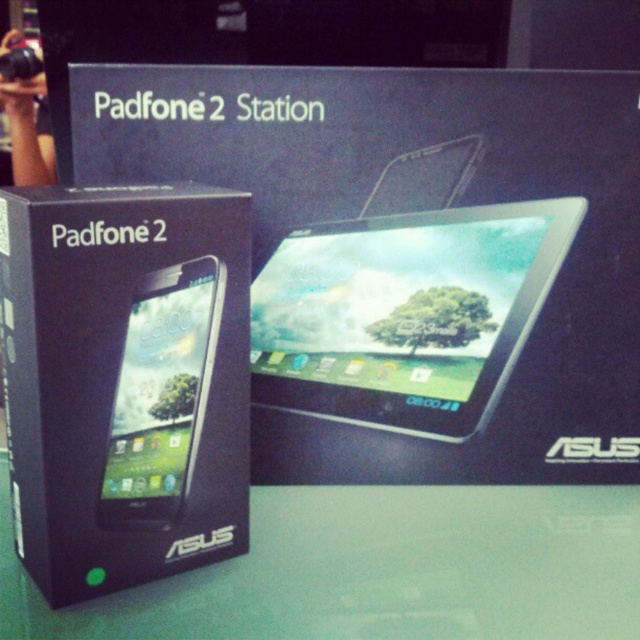
Question: Can you confirm if black matte box at center is positioned to the left of matte black tablet at center?

Choices:
 (A) no
 (B) yes

Answer: (B)

Question: Which of the following is the farthest from the observer?

Choices:
 (A) (129, 396)
 (B) (552, 230)

Answer: (B)

Question: Can you confirm if black matte box at center is bigger than matte black smartphone at center?

Choices:
 (A) yes
 (B) no

Answer: (A)

Question: Which of the following is the farthest from the observer?

Choices:
 (A) matte black smartphone at center
 (B) matte black tablet at center
 (C) black matte box at center

Answer: (B)

Question: Among these points, which one is nearest to the camera?

Choices:
 (A) (394, 289)
 (B) (209, 381)
 (C) (131, 406)

Answer: (C)

Question: Does black matte box at center appear on the right side of matte black smartphone at center?

Choices:
 (A) no
 (B) yes

Answer: (A)